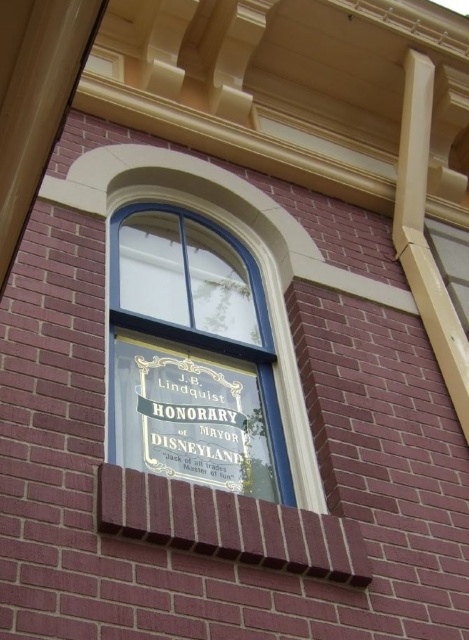
Identify the location of gold metallic plaque at center. (190, 417).

Does gold metallic plaque at center lie behind transparent glass window at center?

No.

Does point (243, 404) come closer to viewer compared to point (284, 320)?

Yes, point (243, 404) is in front of point (284, 320).

Identify the location of gold metallic plaque at center. The width and height of the screenshot is (469, 640). (190, 417).